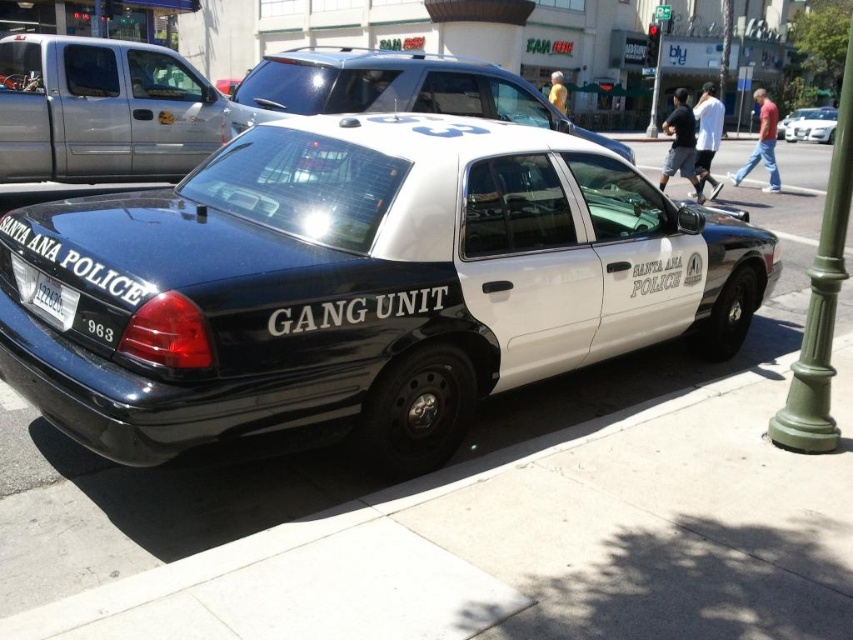
Is white glossy police car at center above white glossy sedan at center?

Yes.

Is white glossy police car at center further to camera compared to white glossy sedan at center?

That is False.

At what (x,y) coordinates should I click in order to perform the action: click on white glossy police car at center. Please return your answer as a coordinate pair (x, y). The image size is (853, 640). Looking at the image, I should click on (392, 90).

Between point (822, 140) and point (776, 124), which one is positioned behind?

Positioned behind is point (822, 140).

Who is more forward, (802,128) or (793,113)?

Positioned in front is point (802,128).

Describe the element at coordinates (811, 125) in the screenshot. I see `white glossy sedan at center` at that location.

This screenshot has height=640, width=853. Find the location of `white glossy sedan at center`. white glossy sedan at center is located at coordinates (811, 125).

Does white glossy police car at center have a smaller size compared to metallic silver sedan at center?

No, white glossy police car at center is not smaller than metallic silver sedan at center.

Can you confirm if white glossy police car at center is positioned above metallic silver sedan at center?

Yes, white glossy police car at center is above metallic silver sedan at center.

Does point (355, 90) come behind point (817, 108)?

No, it is not.

This screenshot has width=853, height=640. Identify the location of white glossy police car at center. tap(392, 90).